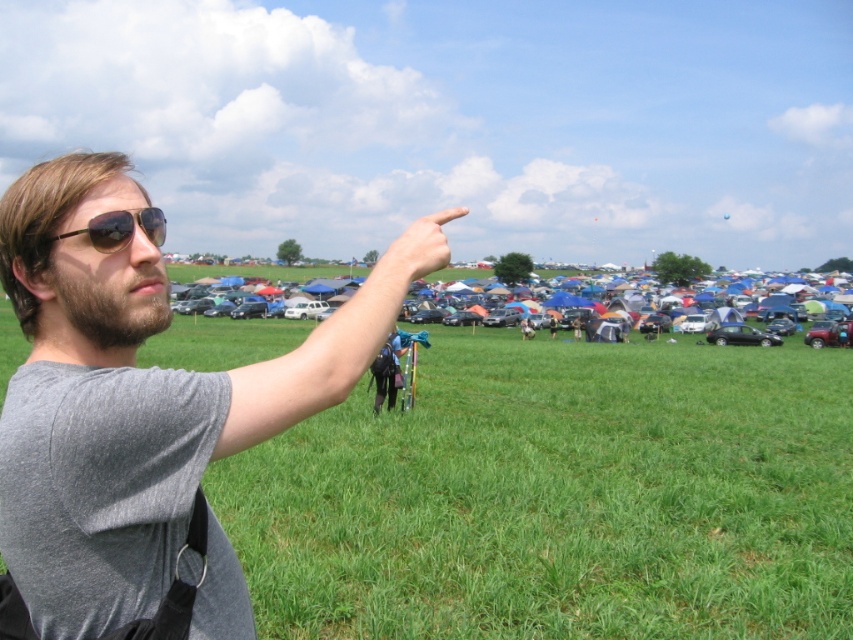
You are a photographer trying to capture the scene with a camera. You notice the gray matte shirt at upper left and the matte black sunglasses at upper left. Which object should you focus on first if you want to ensure both are in frame without moving the camera?

The gray matte shirt at upper left is bigger than the matte black sunglasses at upper left, so you should focus on the gray matte shirt at upper left first to ensure both are in frame without moving the camera.

You are standing at the camera position and see the point marked as point (111, 282). Can you reach this point by taking 2 steps forward?

The point (111, 282) is 4.93 feet away from the camera. Since an average step is about 2.5 to 3 feet, taking 2 steps forward would cover approximately 5 to 6 feet, so yes, you can reach the point by taking 2 steps forward.

You are a tour guide leading a group to a parking lot. You see the shiny metallic cars at center and the metallic silver car at right. Can you tell the group if they are close enough to be considered adjacent to each other?

The shiny metallic cars at center and metallic silver car at right are 50.10 meters apart from each other, so they are not close enough to be considered adjacent.